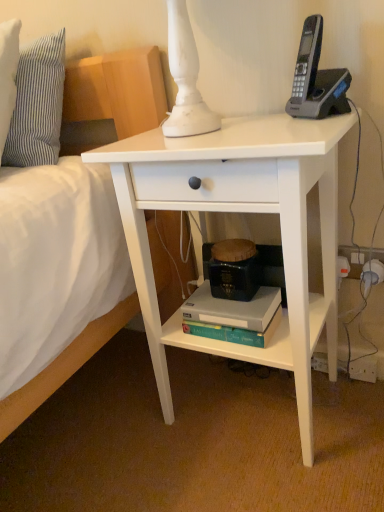
Question: In terms of width, does white matte desk at center look wider or thinner when compared to teal matte paperback book at lower center?

Choices:
 (A) thin
 (B) wide

Answer: (B)

Question: Is white matte desk at center inside or outside of teal matte paperback book at lower center?

Choices:
 (A) outside
 (B) inside

Answer: (A)

Question: Considering the real-world distances, which object is farthest from the white matte desk at center?

Choices:
 (A) black plastic phone at upper right
 (B) striped fabric pillow at upper left
 (C) teal matte paperback book at lower center

Answer: (B)

Question: Estimate the real-world distances between objects in this image. Which object is closer to the teal matte paperback book at lower center?

Choices:
 (A) white matte desk at center
 (B) black plastic phone at upper right
 (C) striped fabric pillow at upper left

Answer: (A)